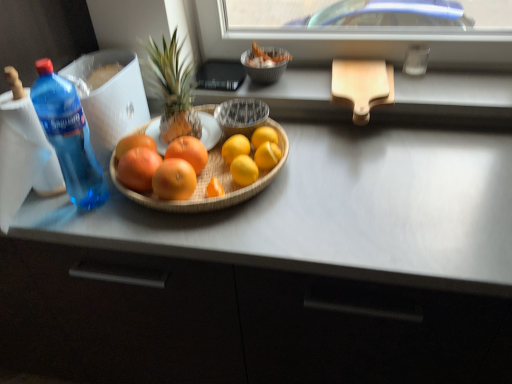
How much space does orange matte grapefruit at center, which ranks as the fourth grapefruit in right-to-left order, occupy horizontally?

It is 3.65 inches.

What are the coordinates of `wooden cutting board at upper right` in the screenshot? It's located at (x=362, y=86).

What is the approximate width of bamboo tray at center?

It is 39.14 centimeters.

Identify the location of bamboo tray at center. (208, 182).

In order to click on orange matte grapefruit at center, positioned as the first grapefruit in left-to-right order in this screenshot , I will do [x=134, y=144].

Between metallic silver bowl at upper center and orange matte grapefruit at center, marked as the second grapefruit in a right-to-left arrangement, which one is positioned in front?

orange matte grapefruit at center, marked as the second grapefruit in a right-to-left arrangement, is more forward.

Between point (280, 64) and point (192, 139), which one is positioned in front?

Positioned in front is point (192, 139).

From a real-world perspective, is metallic silver bowl at upper center physically located above or below orange matte grapefruit at center, marked as the second grapefruit in a right-to-left arrangement?

In terms of real-world spatial position, metallic silver bowl at upper center is above orange matte grapefruit at center, marked as the second grapefruit in a right-to-left arrangement.

From the image's perspective, is metallic silver bowl at upper center positioned above or below orange matte grapefruit at center, marked as the second grapefruit in a right-to-left arrangement?

Clearly, from the image's perspective, metallic silver bowl at upper center is above orange matte grapefruit at center, marked as the second grapefruit in a right-to-left arrangement.

Is the position of wooden cutting board at upper right more distant than that of metallic silver bowl at upper center?

No, the depth of wooden cutting board at upper right is less than that of metallic silver bowl at upper center.

Between wooden cutting board at upper right and metallic silver bowl at upper center, which one has smaller width?

metallic silver bowl at upper center is thinner.

Is wooden cutting board at upper right aimed at metallic silver bowl at upper center?

No, wooden cutting board at upper right is not oriented towards metallic silver bowl at upper center.

Is matte gray counter top at center located within orange matte grapefruit at center, the fifth grapefruit when ordered from right to left?

No, matte gray counter top at center is located outside of orange matte grapefruit at center, the fifth grapefruit when ordered from right to left.

From a real-world perspective, is orange matte grapefruit at center, the fifth grapefruit when ordered from right to left, on matte gray counter top at center?

Yes, from a real-world perspective, orange matte grapefruit at center, the fifth grapefruit when ordered from right to left, is above matte gray counter top at center.

Starting from the matte gray counter top at center, which grapefruit is the 5th one behind? Please provide its 2D coordinates.

[(134, 144)]

Is orange matte grapefruit at center, the fifth grapefruit when ordered from right to left, to the left or to the right of matte gray counter top at center in the image?

Based on their positions, orange matte grapefruit at center, the fifth grapefruit when ordered from right to left, is located to the left of matte gray counter top at center.

From the picture: Considering the relative sizes of wooden cutting board at upper right and orange matte grapefruit at center, positioned as the first grapefruit in left-to-right order, in the image provided, is wooden cutting board at upper right wider than orange matte grapefruit at center, positioned as the first grapefruit in left-to-right order,?

Correct, the width of wooden cutting board at upper right exceeds that of orange matte grapefruit at center, positioned as the first grapefruit in left-to-right order.

From the image's perspective, relative to orange matte grapefruit at center, positioned as the first grapefruit in left-to-right order, is wooden cutting board at upper right above or below?

Clearly, from the image's perspective, wooden cutting board at upper right is above orange matte grapefruit at center, positioned as the first grapefruit in left-to-right order.

From the picture: Is wooden cutting board at upper right to the left or to the right of orange matte grapefruit at center, the fifth grapefruit when ordered from right to left, in the image?

Clearly, wooden cutting board at upper right is on the right of orange matte grapefruit at center, the fifth grapefruit when ordered from right to left, in the image.

How different are the orientations of wooden cutting board at upper right and orange matte grapefruit at center, positioned as the first grapefruit in left-to-right order, in degrees?

The angular difference between wooden cutting board at upper right and orange matte grapefruit at center, positioned as the first grapefruit in left-to-right order, is 25.7 degrees.

From a real-world perspective, who is located higher, orange matte grapefruit at center, which ranks as the fourth grapefruit in right-to-left order, or yellow matte grapefruit at center, which is the fifth grapefruit in left-to-right order?

orange matte grapefruit at center, which ranks as the fourth grapefruit in right-to-left order, from a real-world perspective.

Based on the photo, who is taller, orange matte grapefruit at center, marked as the 2th grapefruit in a left-to-right arrangement, or yellow matte grapefruit at center, arranged as the first grapefruit when viewed from the right?

yellow matte grapefruit at center, arranged as the first grapefruit when viewed from the right, is taller.

Considering the positions of objects orange matte grapefruit at center, which ranks as the fourth grapefruit in right-to-left order, and yellow matte grapefruit at center, arranged as the first grapefruit when viewed from the right, in the image provided, who is more to the right, orange matte grapefruit at center, which ranks as the fourth grapefruit in right-to-left order, or yellow matte grapefruit at center, arranged as the first grapefruit when viewed from the right,?

yellow matte grapefruit at center, arranged as the first grapefruit when viewed from the right.

Is orange matte grapefruit at center, marked as the 2th grapefruit in a left-to-right arrangement, placed right next to yellow matte grapefruit at center, which is the fifth grapefruit in left-to-right order?

No.

At what (x,y) coordinates should I click in order to perform the action: click on bottle located in front of the bamboo tray at center. Please return your answer as a coordinate pair (x, y). This screenshot has height=384, width=512. Looking at the image, I should click on (68, 136).

Considering the sizes of blue translucent bottle at left and bamboo tray at center in the image, is blue translucent bottle at left bigger or smaller than bamboo tray at center?

In the image, blue translucent bottle at left appears to be smaller than bamboo tray at center.

From the image's perspective, is blue translucent bottle at left over bamboo tray at center?

Yes, from the image's perspective, blue translucent bottle at left is on top of bamboo tray at center.

Considering the sizes of objects blue translucent bottle at left and bamboo tray at center in the image provided, who is taller, blue translucent bottle at left or bamboo tray at center?

Standing taller between the two is blue translucent bottle at left.

Would you say wooden cutting board at upper right is to the left or to the right of orange matte grapefruit at center, arranged as the 3th grapefruit when viewed from the left, in the picture?

In the image, wooden cutting board at upper right appears on the right side of orange matte grapefruit at center, arranged as the 3th grapefruit when viewed from the left.

This screenshot has height=384, width=512. In order to click on cutting board that appears behind the orange matte grapefruit at center, arranged as the 3th grapefruit when viewed from the left in this screenshot , I will do `click(362, 86)`.

From a real-world perspective, which is physically above, wooden cutting board at upper right or orange matte grapefruit at center, positioned as the 3th grapefruit in right-to-left order?

wooden cutting board at upper right.

Which of these two, wooden cutting board at upper right or orange matte grapefruit at center, arranged as the 3th grapefruit when viewed from the left, stands shorter?

Standing shorter between the two is wooden cutting board at upper right.

From a real-world perspective, starting from the metallic silver bowl at upper center, which grapefruit is the 5th one below it? Please provide its 2D coordinates.

[(188, 152)]

The height and width of the screenshot is (384, 512). I want to click on glass bowl that appears above the wooden cutting board at upper right (from the image's perspective), so click(263, 70).

Based on the photo, looking at the image, which one is located closer to orange matte grapefruit at center, arranged as the 3th grapefruit when viewed from the left, blue translucent bottle at left or metallic silver bowl at upper center?

blue translucent bottle at left is closer to orange matte grapefruit at center, arranged as the 3th grapefruit when viewed from the left.

Based on their spatial positions, is matte gray counter top at center or orange matte grapefruit at center, positioned as the 3th grapefruit in right-to-left order, closer to green textured pineapple at center?

orange matte grapefruit at center, positioned as the 3th grapefruit in right-to-left order, is positioned closer to the anchor green textured pineapple at center.

Based on their spatial positions, is orange matte grapefruit at center, which is the fourth grapefruit from left to right, or orange matte grapefruit at center, arranged as the 3th grapefruit when viewed from the left, further from wooden cutting board at upper right?

orange matte grapefruit at center, arranged as the 3th grapefruit when viewed from the left.

When comparing their distances from orange matte grapefruit at center, marked as the 2th grapefruit in a left-to-right arrangement, does orange matte grapefruit at center, arranged as the 3th grapefruit when viewed from the left, or metallic silver bowl at upper center seem further?

The object further to orange matte grapefruit at center, marked as the 2th grapefruit in a left-to-right arrangement, is metallic silver bowl at upper center.

Estimate the real-world distances between objects in this image. Which object is closer to orange matte grapefruit at center, marked as the second grapefruit in a right-to-left arrangement, orange matte grapefruit at center, arranged as the 3th grapefruit when viewed from the left, or orange matte grapefruit at center, positioned as the first grapefruit in left-to-right order?

orange matte grapefruit at center, arranged as the 3th grapefruit when viewed from the left.

Estimate the real-world distances between objects in this image. Which object is closer to orange matte grapefruit at center, positioned as the first grapefruit in left-to-right order, bamboo tray at center or metallic silver bowl at upper center?

bamboo tray at center lies closer to orange matte grapefruit at center, positioned as the first grapefruit in left-to-right order, than the other object.

Consider the image. Considering their positions, is orange matte grapefruit at center, arranged as the 3th grapefruit when viewed from the left, positioned closer to bamboo tray at center than matte gray counter top at center?

orange matte grapefruit at center, arranged as the 3th grapefruit when viewed from the left, is closer to bamboo tray at center.

Estimate the real-world distances between objects in this image. Which object is closer to orange matte grapefruit at center, positioned as the 3th grapefruit in right-to-left order, orange matte grapefruit at center, which ranks as the fourth grapefruit in right-to-left order, or matte gray counter top at center?

orange matte grapefruit at center, which ranks as the fourth grapefruit in right-to-left order.

This screenshot has width=512, height=384. Find the location of `pineapple between orange matte grapefruit at center, marked as the 2th grapefruit in a left-to-right arrangement, and yellow matte grapefruit at center, arranged as the first grapefruit when viewed from the right, in the horizontal direction`. pineapple between orange matte grapefruit at center, marked as the 2th grapefruit in a left-to-right arrangement, and yellow matte grapefruit at center, arranged as the first grapefruit when viewed from the right, in the horizontal direction is located at coordinates (172, 88).

The width and height of the screenshot is (512, 384). I want to click on pineapple between blue translucent bottle at left and bamboo tray at center in the horizontal direction, so click(172, 88).

Find the location of a particular element. bowl between orange matte grapefruit at center, marked as the 2th grapefruit in a left-to-right arrangement, and matte gray counter top at center is located at coordinates (208, 182).

Where is `bowl between metallic silver bowl at upper center and orange matte grapefruit at center, which ranks as the fourth grapefruit in right-to-left order, vertically`? The image size is (512, 384). bowl between metallic silver bowl at upper center and orange matte grapefruit at center, which ranks as the fourth grapefruit in right-to-left order, vertically is located at coordinates (208, 182).